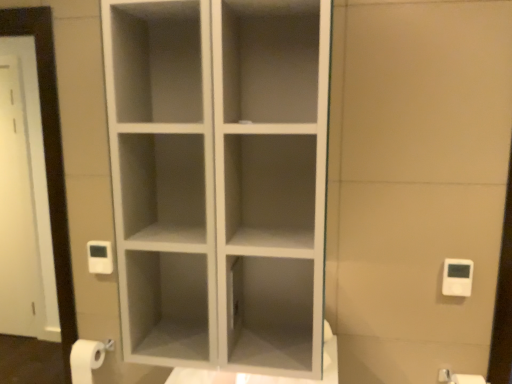
Question: Relative to white plastic light switch at right, is white matte toilet paper at lower right in front or behind?

Choices:
 (A) front
 (B) behind

Answer: (A)

Question: From the image's perspective, relative to white plastic light switch at right, is white matte toilet paper at lower right above or below?

Choices:
 (A) above
 (B) below

Answer: (B)

Question: Visually, is white matte toilet paper at lower right positioned to the left or to the right of white plastic light switch at right?

Choices:
 (A) left
 (B) right

Answer: (B)

Question: In terms of size, does white plastic light switch at right appear bigger or smaller than white matte toilet paper at lower right?

Choices:
 (A) small
 (B) big

Answer: (A)

Question: Looking at their shapes, would you say white plastic light switch at right is wider or thinner than white matte toilet paper at lower right?

Choices:
 (A) wide
 (B) thin

Answer: (B)

Question: From the image's perspective, relative to white matte toilet paper at lower right, is white plastic light switch at right above or below?

Choices:
 (A) above
 (B) below

Answer: (A)

Question: Visually, is white plastic light switch at right positioned to the left or to the right of white matte toilet paper at lower right?

Choices:
 (A) left
 (B) right

Answer: (A)